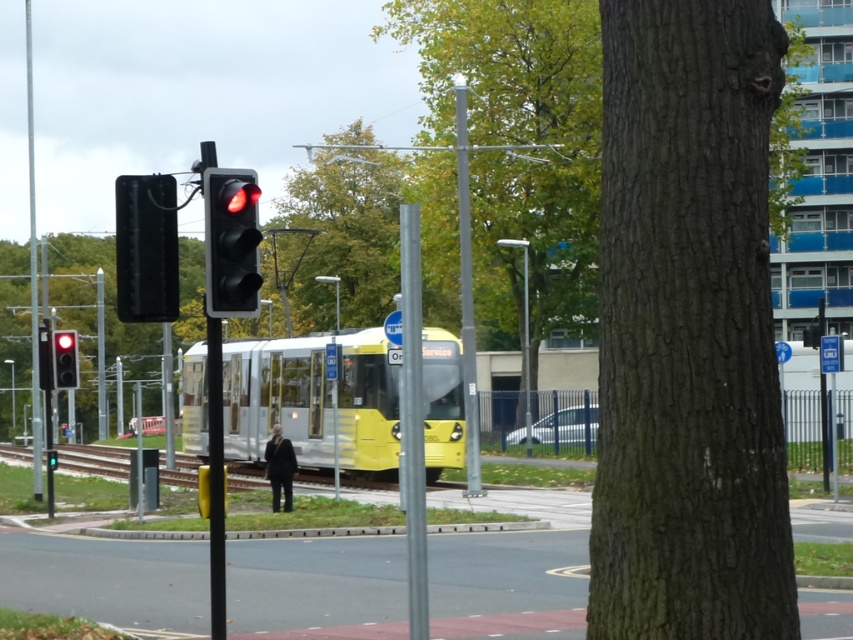
Between yellow matte passenger train at center and black plastic traffic light at left, which one is positioned lower?

yellow matte passenger train at center is lower down.

Where is `yellow matte passenger train at center`? The image size is (853, 640). yellow matte passenger train at center is located at coordinates (312, 400).

Locate an element on the screen. The height and width of the screenshot is (640, 853). yellow matte passenger train at center is located at coordinates (312, 400).

Can you confirm if silver metallic pole at center is positioned above metallic pole at left?

Actually, silver metallic pole at center is below metallic pole at left.

Between silver metallic pole at center and metallic pole at left, which one is positioned lower?

Positioned lower is silver metallic pole at center.

This screenshot has width=853, height=640. Identify the location of silver metallic pole at center. [412, 420].

Is yellow matte passenger train at center further to camera compared to red glass traffic light at left?

No, it is not.

Is point (442, 385) closer to camera compared to point (68, 381)?

No, it is behind (68, 381).

Which is in front, point (277, 362) or point (76, 378)?

Positioned in front is point (76, 378).

Find the location of `yellow matte passenger train at center`. yellow matte passenger train at center is located at coordinates (312, 400).